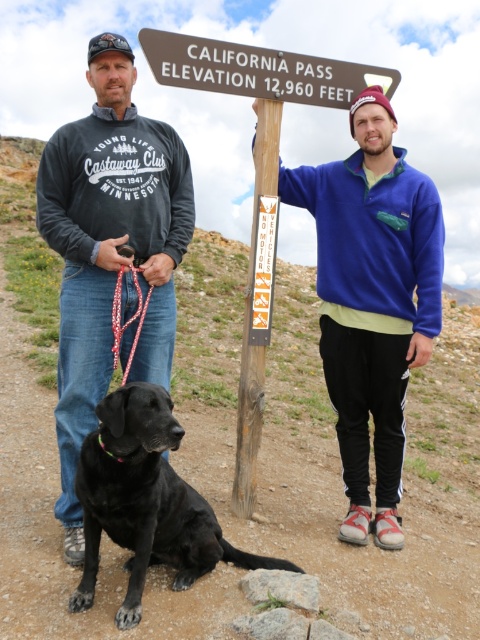
Who is higher up, matte gray hoodie at left or blue fleece jacket at center?

Positioned higher is matte gray hoodie at left.

Which is below, matte gray hoodie at left or blue fleece jacket at center?

blue fleece jacket at center is lower down.

Measure the distance between point [74,380] and camera.

Point [74,380] and camera are 3.50 meters apart.

This screenshot has width=480, height=640. Find the location of `matte gray hoodie at left`. matte gray hoodie at left is located at coordinates (109, 248).

Based on the photo, can you confirm if matte gray hoodie at left is thinner than pink beaded leash at lower left?

No.

Is point (48, 224) farther from camera compared to point (121, 269)?

Yes.

Is point (166, 184) less distant than point (120, 316)?

That is False.

Locate an element on the screen. Image resolution: width=480 pixels, height=640 pixels. matte gray hoodie at left is located at coordinates (109, 248).

Does matte black dog at lower left appear on the left side of matte gray hoodie at left?

No, matte black dog at lower left is not to the left of matte gray hoodie at left.

Is point (100, 170) farther from camera compared to point (71, 173)?

That is False.

Locate an element on the screen. Image resolution: width=480 pixels, height=640 pixels. matte black dog at lower left is located at coordinates (109, 248).